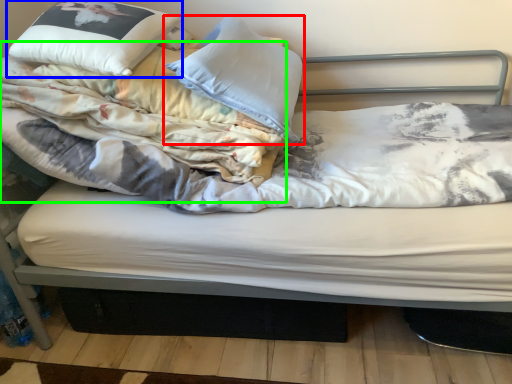
Question: Which object is the closest to the pillow (highlighted by a red box)? Choose among these: pillow (highlighted by a blue box) or blanket (highlighted by a green box).

Choices:
 (A) pillow
 (B) blanket

Answer: (B)